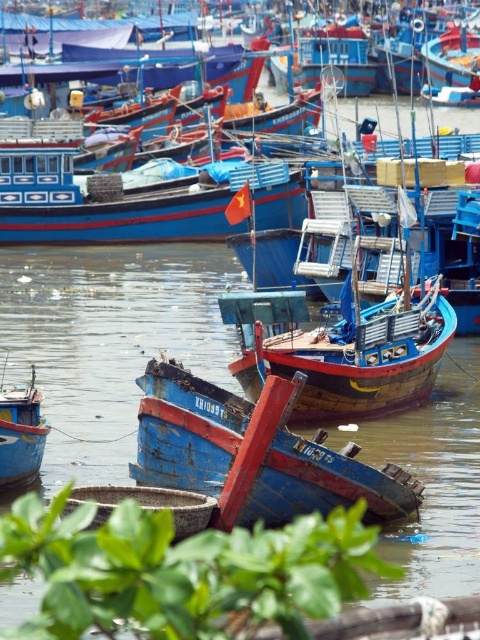
Question: Can you confirm if blue wooden boat at center is wider than blue wooden boat at lower left?

Choices:
 (A) yes
 (B) no

Answer: (A)

Question: Which point appears farthest from the camera in this image?

Choices:
 (A) (34, 467)
 (B) (230, 424)

Answer: (A)

Question: Does blue wooden boat at center have a larger size compared to blue wooden boat at lower left?

Choices:
 (A) no
 (B) yes

Answer: (B)

Question: Is blue wooden boat at center to the right of blue wooden boat at lower left from the viewer's perspective?

Choices:
 (A) yes
 (B) no

Answer: (A)